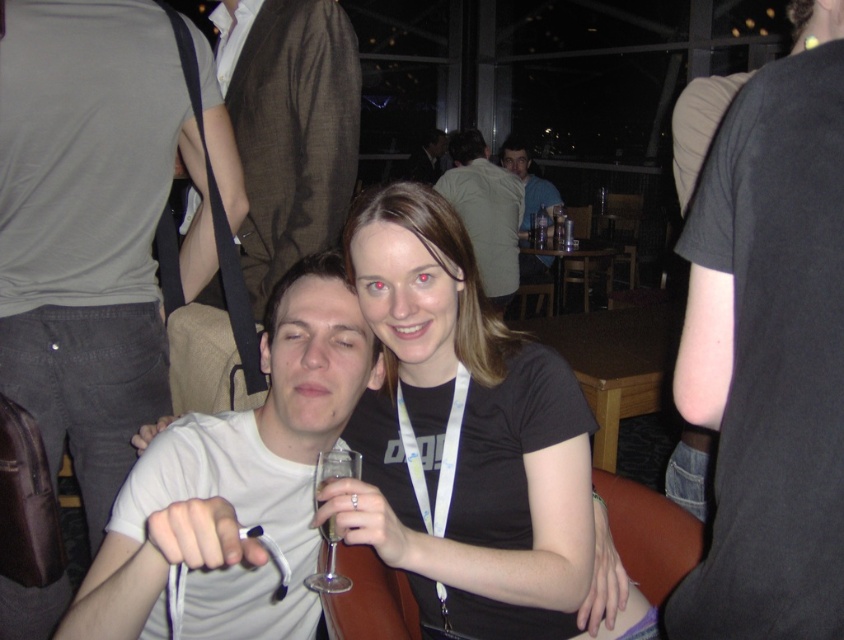
You are standing at the entrance of the bar and see two points marked in the scene. The first point is at coordinates point (169, 65) and the second is at point (436, 145). Which point is closer to you?

Point (169, 65) is in front of point (436, 145), so it is closer to you.